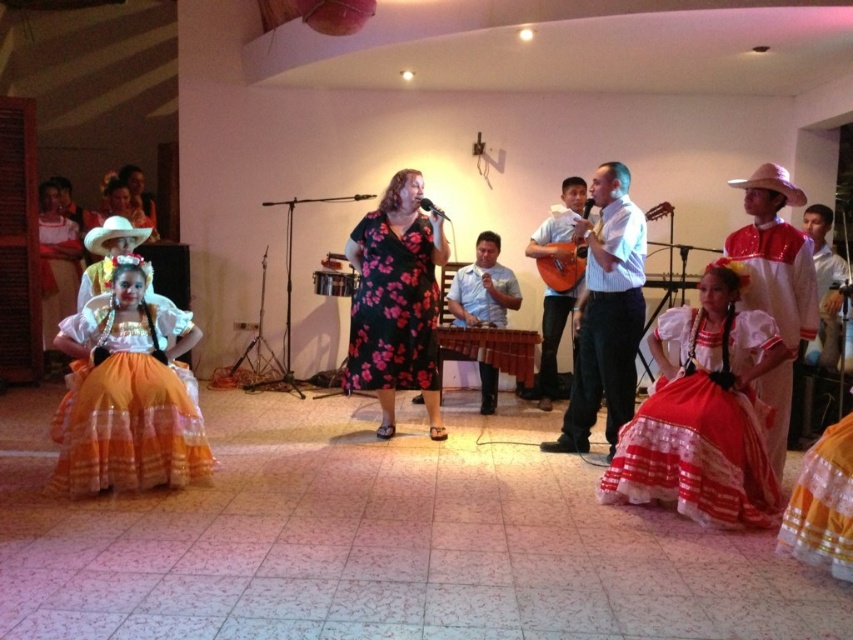
Question: In this image, where is orange satin dress at left located relative to matte orange guitar at center?

Choices:
 (A) above
 (B) below

Answer: (B)

Question: Does orange satin dress at lower left have a larger size compared to white cotton shirt at center?

Choices:
 (A) no
 (B) yes

Answer: (A)

Question: Which point is farther from the camera taking this photo?

Choices:
 (A) (555, 364)
 (B) (666, 458)

Answer: (A)

Question: Is matte orange guitar at center bigger than light blue shirt at center?

Choices:
 (A) no
 (B) yes

Answer: (B)

Question: Estimate the real-world distances between objects in this image. Which object is farther from the matte orange guitar at center?

Choices:
 (A) wooden marimba at center
 (B) light blue shirt at center
 (C) orange satin dress at lower left

Answer: (C)

Question: Considering the real-world distances, which object is farthest from the floral-patterned dress at center?

Choices:
 (A) orange satin dress at left
 (B) orange satin dress at lower left

Answer: (B)